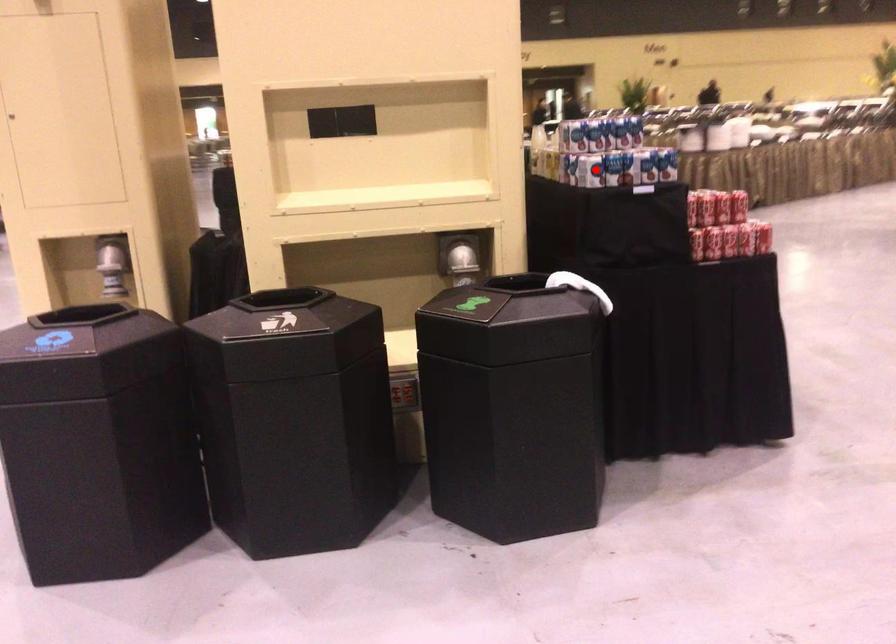
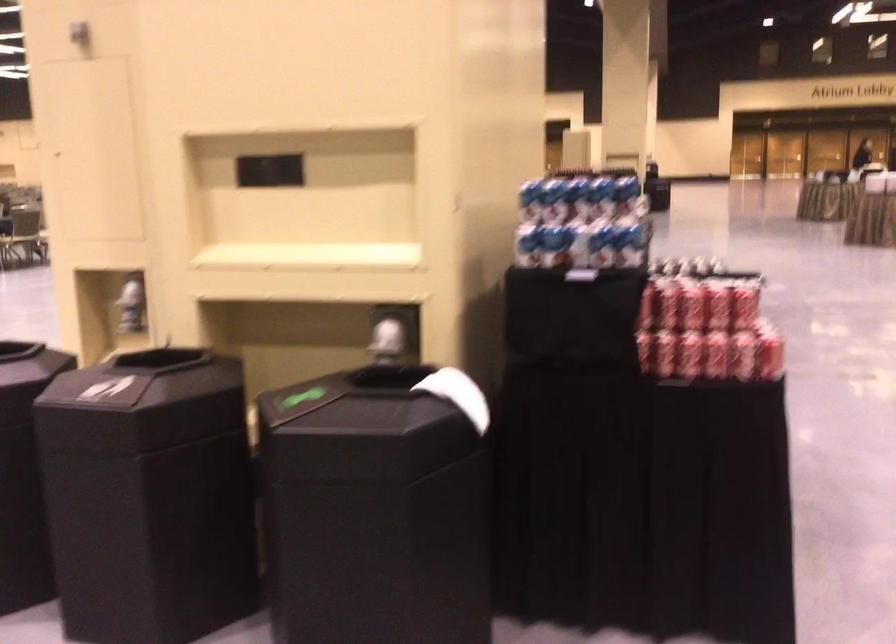
Locate, in the second image, the point that corresponds to the highlighted location in the first image.

(528, 245)